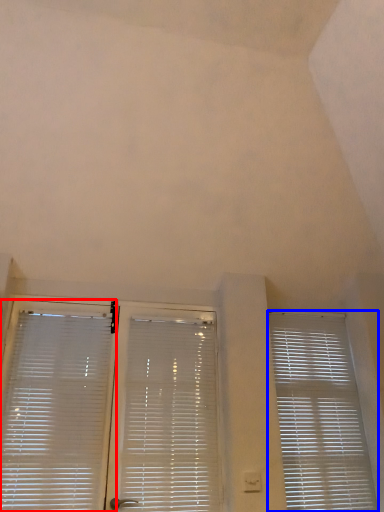
Question: Which of the following is the closest to the observer, window blind (highlighted by a red box) or window blind (highlighted by a blue box)?

Choices:
 (A) window blind
 (B) window blind

Answer: (A)